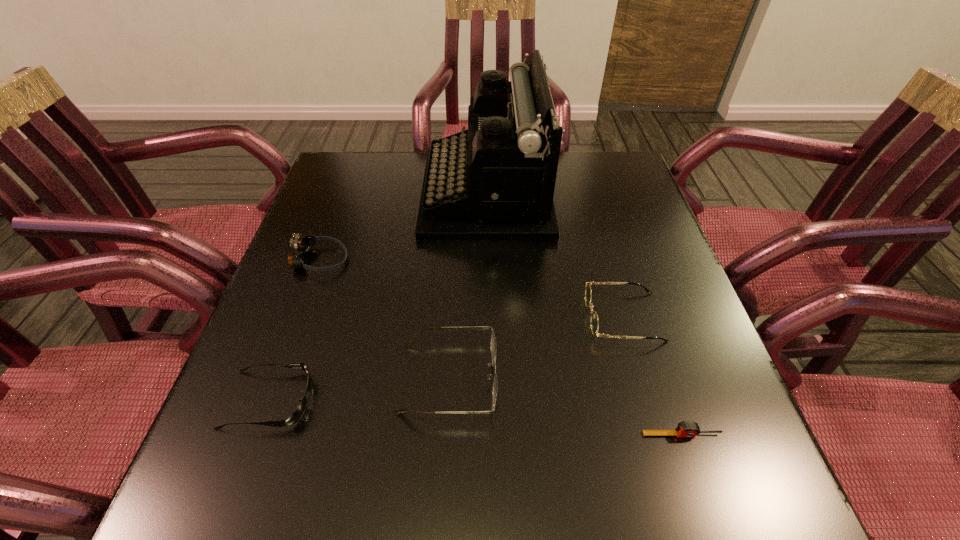
You are a GUI agent. You are given a task and a screenshot of the screen. Output one action in this format:
    pyautogui.click(x=<x>, y=<y>)
    Task: Click on the tallest object
    
    Given the screenshot: What is the action you would take?
    495,181

Where is `typewriter`? Image resolution: width=960 pixels, height=540 pixels. typewriter is located at coordinates (495, 181).

Find the location of a particular element. The height and width of the screenshot is (540, 960). the right spectacles is located at coordinates (594, 322).

Image resolution: width=960 pixels, height=540 pixels. I want to click on goggles, so click(x=301, y=244).

Identify the location of the left spectacles. The image size is (960, 540). (493, 346).

This screenshot has height=540, width=960. I want to click on sunglasses, so click(x=299, y=411).

Locate an element on the screen. The height and width of the screenshot is (540, 960). tape measure is located at coordinates (685, 429).

The image size is (960, 540). Identify the location of free space located 0.170m on the typing side of the typewriter. (362, 194).

Identify the location of free space located on the typing side of the typewriter. (362, 194).

Find the location of a particular element. This screenshot has width=960, height=540. free location located on the typing side of the typewriter is located at coordinates (350, 194).